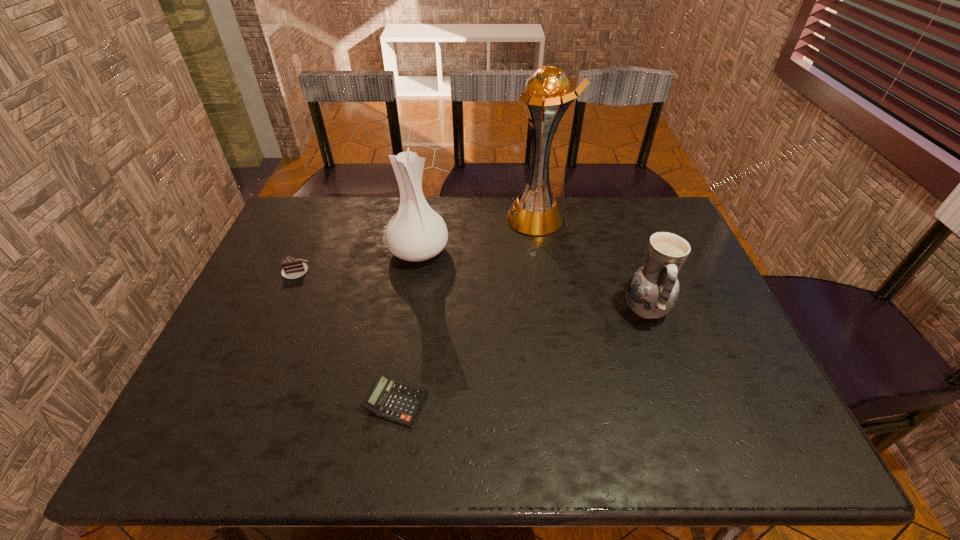
The width and height of the screenshot is (960, 540). In order to click on vacant region between the second shortest object and the third shortest object in this screenshot , I will do `click(470, 290)`.

Identify the location of free space between the vase and the tallest object. (477, 234).

Identify the location of vacant region between the nearest object and the fourth object from left to right. (466, 309).

Locate an element on the screen. The image size is (960, 540). free space between the vase and the shortest object is located at coordinates (407, 326).

Locate an element on the screen. This screenshot has height=540, width=960. free space that is in between the trophy and the third shortest object is located at coordinates (590, 264).

Where is `vacant space that's between the rightmost object and the tallest object`? The width and height of the screenshot is (960, 540). vacant space that's between the rightmost object and the tallest object is located at coordinates (590, 264).

Find the location of `empty space between the fourth farthest object and the tallest object`. empty space between the fourth farthest object and the tallest object is located at coordinates (590, 264).

Identify which object is the fourth closest to the second object from right to left. Please provide its 2D coordinates. Your answer should be formatted as a tuple, i.e. [(x, y)], where the tuple contains the x and y coordinates of a point satisfying the conditions above.

[(293, 268)]

You are a GUI agent. You are given a task and a screenshot of the screen. Output one action in this format:
    pyautogui.click(x=<x>, y=<y>)
    Task: Click on the object that stands as the third closest to the fourth shortest object
    The width and height of the screenshot is (960, 540).
    Given the screenshot: What is the action you would take?
    pyautogui.click(x=391, y=399)

You are a GUI agent. You are given a task and a screenshot of the screen. Output one action in this format:
    pyautogui.click(x=<x>, y=<y>)
    Task: Click on the vacant space that satisfies the following two spatial constraints: 1. on either side of the pottery; 2. on the front side of the calculator
    
    Given the screenshot: What is the action you would take?
    pyautogui.click(x=678, y=401)